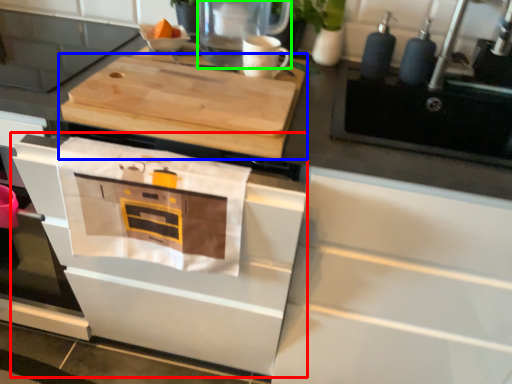
Question: Considering the real-world distances, which object is farthest from oven (highlighted by a red box)? cutting board (highlighted by a blue box) or kitchen appliance (highlighted by a green box)?

Choices:
 (A) cutting board
 (B) kitchen appliance

Answer: (B)